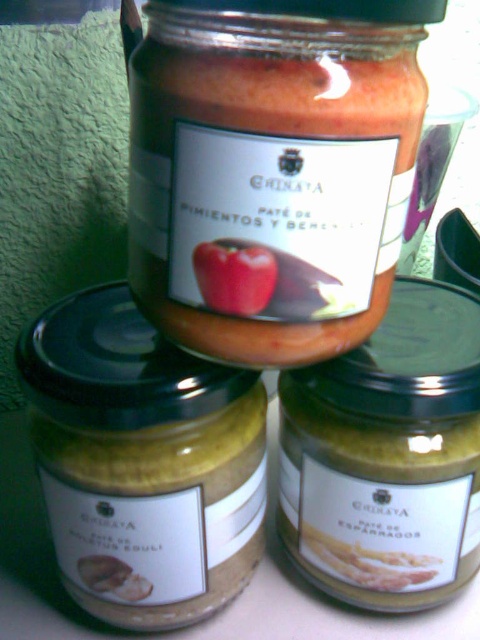
Is matte glass jar at center thinner than matte yellow spread at lower left?

Incorrect, matte glass jar at center's width is not less than matte yellow spread at lower left's.

Is matte glass jar at center closer to the viewer compared to matte yellow spread at lower left?

Yes, it is in front of matte yellow spread at lower left.

Does point (238, 115) come behind point (200, 516)?

No, (238, 115) is closer to viewer.

The width and height of the screenshot is (480, 640). In order to click on matte glass jar at center in this screenshot , I will do `click(273, 170)`.

Looking at this image, which is more to the right, green matte jar of pâté de espárragos at center or red matte apple at center?

green matte jar of pâté de espárragos at center

Can you confirm if green matte jar of pâté de espárragos at center is positioned above red matte apple at center?

No.

Which is behind, point (301, 490) or point (212, 294)?

Positioned behind is point (301, 490).

Where is `green matte jar of pâté de espárragos at center`? This screenshot has height=640, width=480. green matte jar of pâté de espárragos at center is located at coordinates pos(387,456).

Between matte glass jar at center and red matte apple at center, which one appears on the right side from the viewer's perspective?

From the viewer's perspective, matte glass jar at center appears more on the right side.

Image resolution: width=480 pixels, height=640 pixels. What do you see at coordinates (273, 170) in the screenshot?
I see `matte glass jar at center` at bounding box center [273, 170].

This screenshot has width=480, height=640. What are the coordinates of `matte glass jar at center` in the screenshot? It's located at (273, 170).